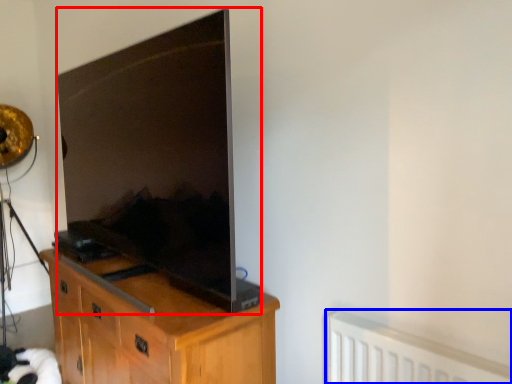
Question: Among these objects, which one is nearest to the camera, television (highlighted by a red box) or radiator (highlighted by a blue box)?

Choices:
 (A) television
 (B) radiator

Answer: (B)